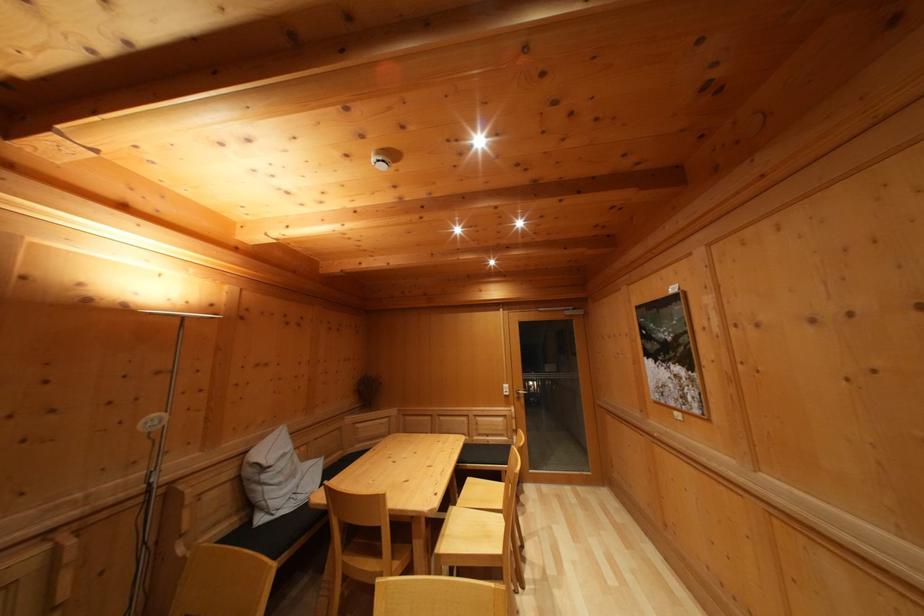
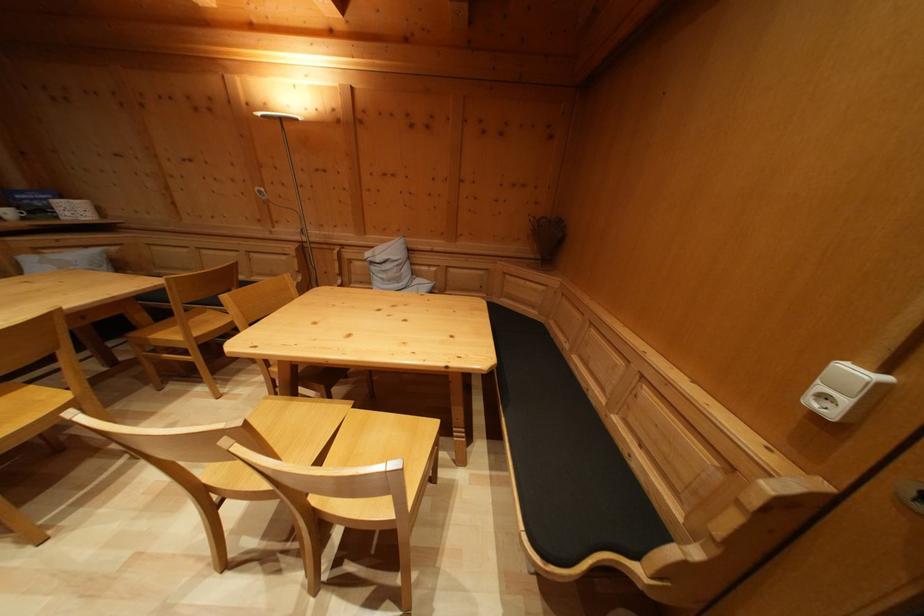
Where in the second image is the point corresponding to point 512,392 from the first image?

(859, 379)